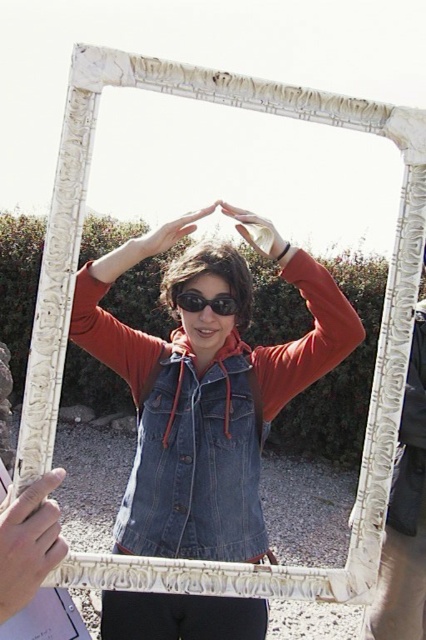
From the picture: You are a photographer trying to capture a photo of the person in the scene. You notice the white carved frame at center and the black plastic goggles at center. Which object is taller and would require adjusting your camera angle to include both in the frame?

The white carved frame at center is taller than the black plastic goggles at center, so you would need to adjust your camera angle to ensure both are fully visible in the photo.

You are a photographer adjusting your camera to capture the scene. You notice two points marked in the image. Which point, point (x=178, y=506) or point (x=396, y=584), is nearer to your camera lens?

Point (x=178, y=506) is closer to the camera than point (x=396, y=584).